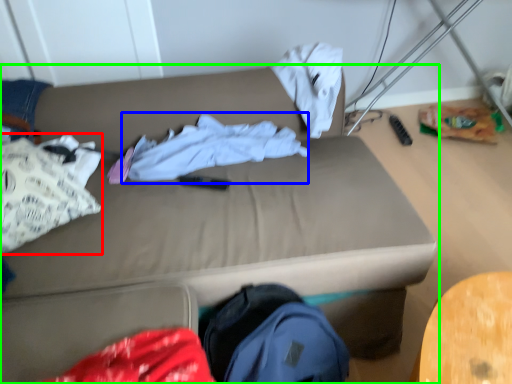
Question: Which object is positioned closest to clothing (highlighted by a red box)? Select from clothing (highlighted by a blue box) and studio couch (highlighted by a green box).

Choices:
 (A) clothing
 (B) studio couch

Answer: (B)